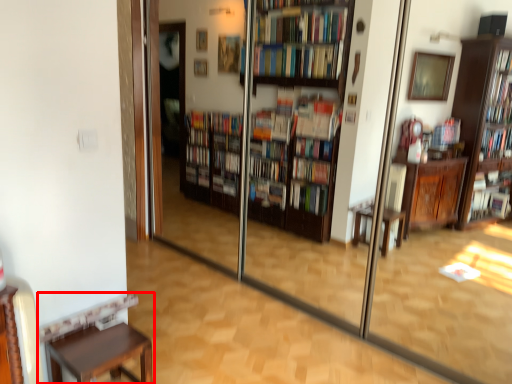
Question: From the image's perspective, what is the correct spatial positioning of furniture (annotated by the red box) in reference to screen door?

Choices:
 (A) above
 (B) below

Answer: (B)